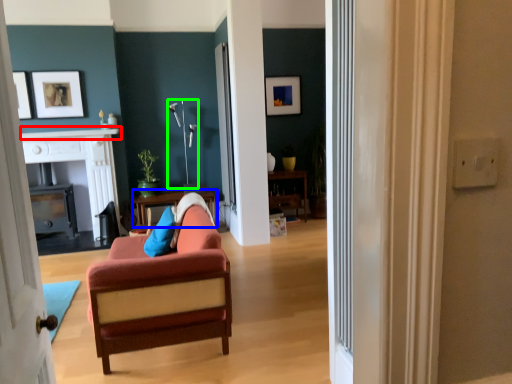
Question: Which object is the closest to the mantle (highlighted by a red box)? Choose among these: table (highlighted by a blue box) or lamp (highlighted by a green box).

Choices:
 (A) table
 (B) lamp

Answer: (B)